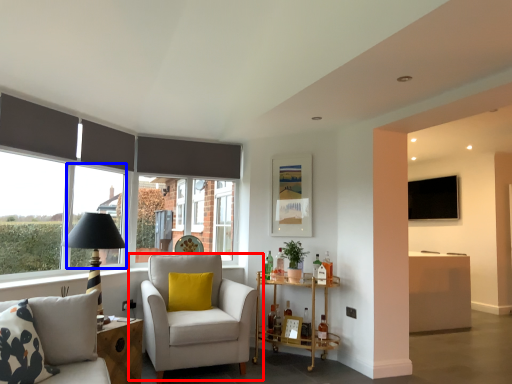
Question: Which object appears closest to the camera in this image, chair (highlighted by a red box) or window (highlighted by a blue box)?

Choices:
 (A) chair
 (B) window

Answer: (A)